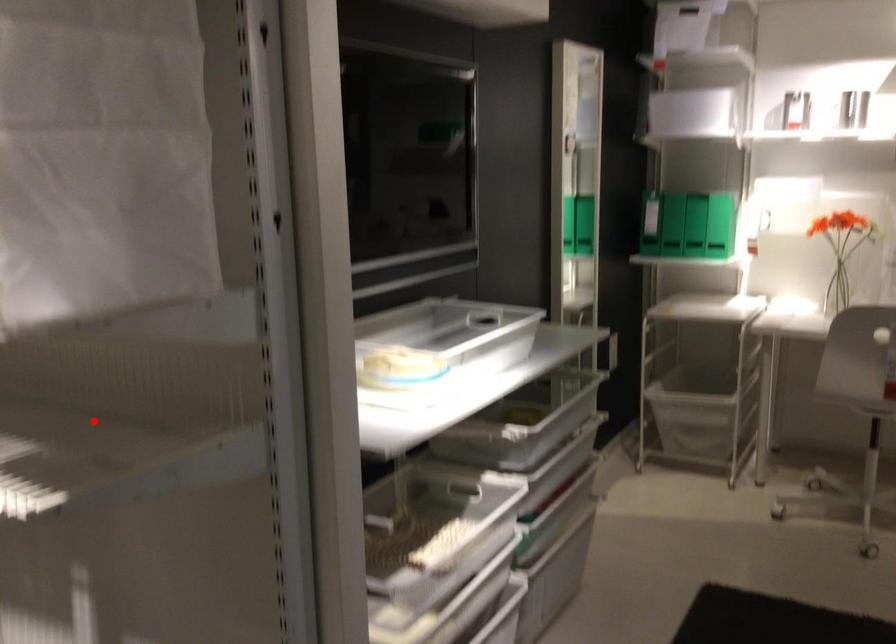
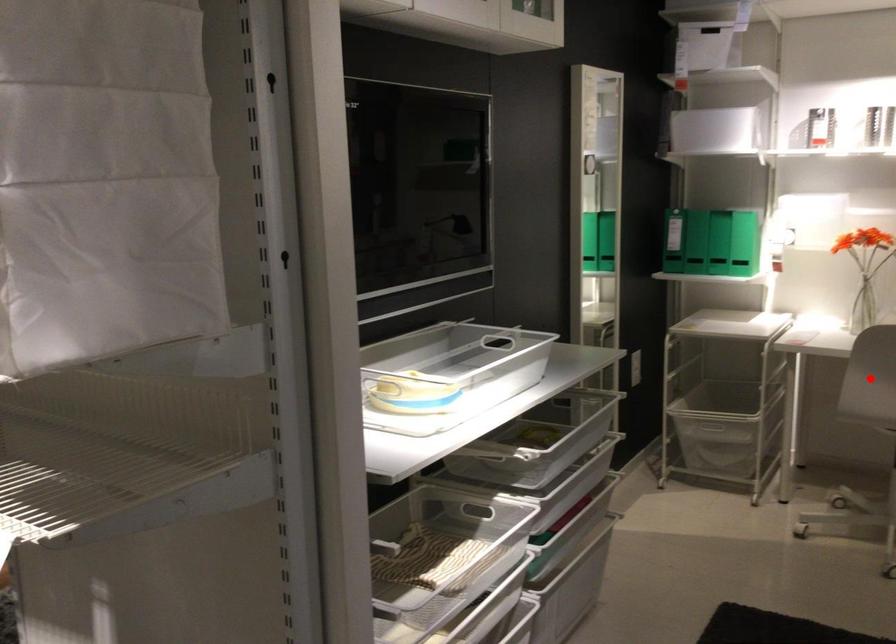
I am providing you with two images of the same scene from different viewpoints. A red point is marked on the first image and another point is marked on the second image. Is the marked point in image1 the same physical position as the marked point in image2?

No